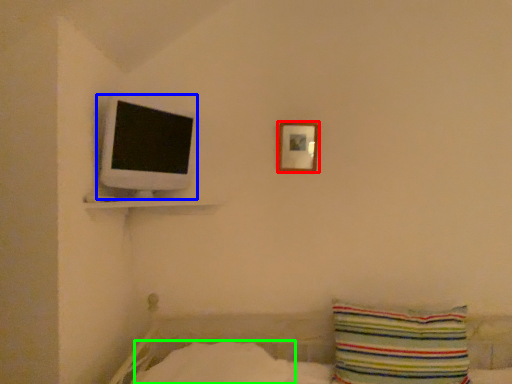
Question: Considering the real-world distances, which object is closest to picture frame (highlighted by a red box)? computer monitor (highlighted by a blue box) or sheet (highlighted by a green box).

Choices:
 (A) computer monitor
 (B) sheet

Answer: (A)